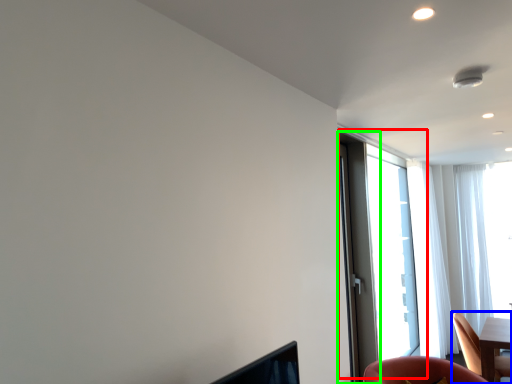
Question: Based on their relative distances, which object is nearer to window (highlighted by a red box)? Choose from chair (highlighted by a blue box) and screen door (highlighted by a green box).

Choices:
 (A) chair
 (B) screen door

Answer: (B)